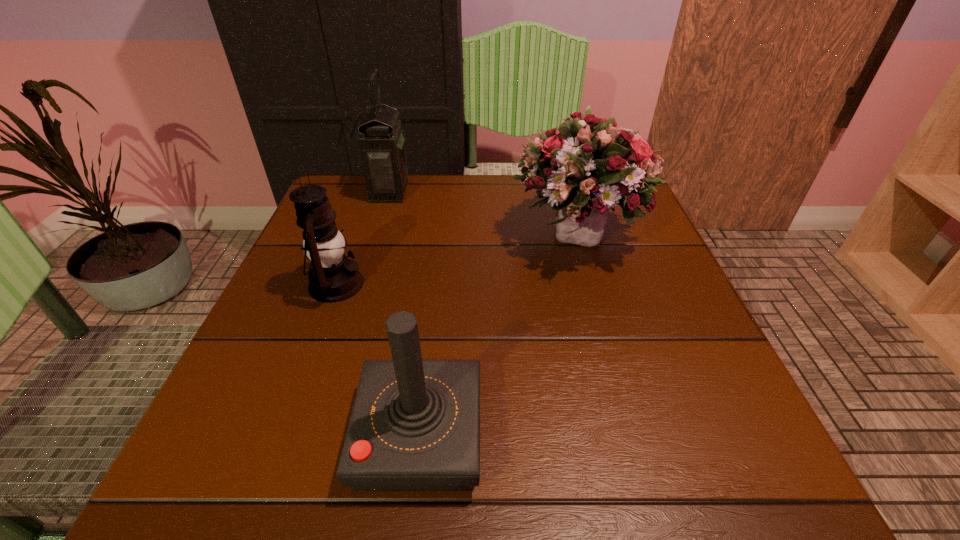
Where is `vacant space in between the rightmost object and the third object from left to right`? Image resolution: width=960 pixels, height=540 pixels. vacant space in between the rightmost object and the third object from left to right is located at coordinates (499, 337).

This screenshot has width=960, height=540. What are the coordinates of `free spot between the third object from left to right and the nearer lantern` in the screenshot? It's located at (378, 360).

Locate an element on the screen. The height and width of the screenshot is (540, 960). free spot between the bouquet and the farther lantern is located at coordinates (485, 215).

Find the location of a particular element. Image resolution: width=960 pixels, height=540 pixels. vacant area between the farther lantern and the rightmost object is located at coordinates click(485, 215).

This screenshot has height=540, width=960. Find the location of `free space that is in between the nearer lantern and the rightmost object`. free space that is in between the nearer lantern and the rightmost object is located at coordinates (458, 261).

You are a GUI agent. You are given a task and a screenshot of the screen. Output one action in this format:
    pyautogui.click(x=<x>, y=<y>)
    Task: Click on the vacant region between the rightmost object and the farther lantern
    The image size is (960, 540).
    Given the screenshot: What is the action you would take?
    pyautogui.click(x=485, y=215)

Locate an element on the screen. empty space that is in between the farther lantern and the bouquet is located at coordinates (485, 215).

Where is `vacant space that is in between the rightmost object and the farther lantern`? vacant space that is in between the rightmost object and the farther lantern is located at coordinates (485, 215).

Locate an element on the screen. the closest object to the joystick is located at coordinates (334, 278).

Identify which object is located as the third nearest to the rightmost object. Please provide its 2D coordinates. Your answer should be formatted as a tuple, i.e. [(x, y)], where the tuple contains the x and y coordinates of a point satisfying the conditions above.

[(334, 278)]